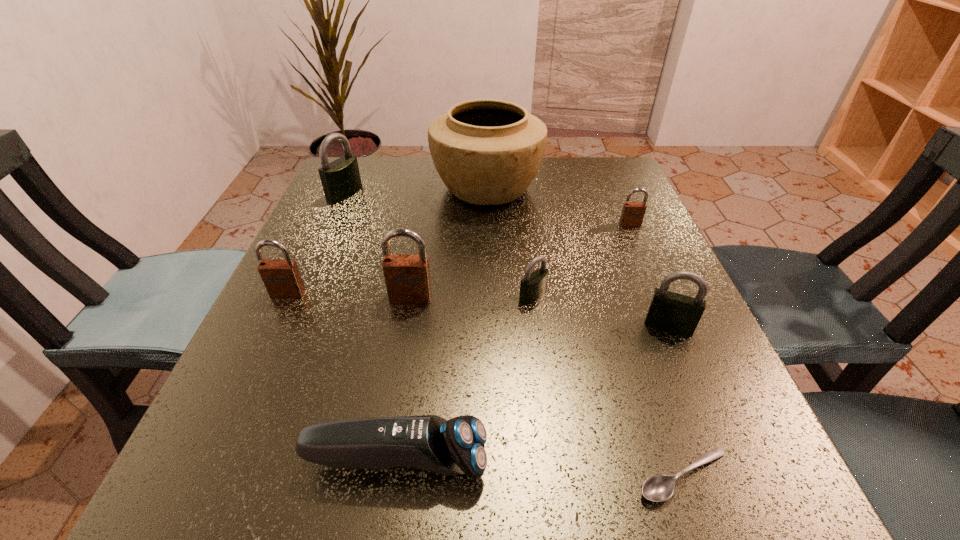
Find the location of `free space located on the back of the second farthest black padlock`. free space located on the back of the second farthest black padlock is located at coordinates (525, 235).

Identify the location of vacant space situated on the front-facing side of the smallest brown padlock. (695, 374).

Locate an element on the screen. The height and width of the screenshot is (540, 960). vacant space situated 0.300m on the head of the electric shaver is located at coordinates (720, 461).

Identify the location of vacant region located on the back of the gray soupspoon. (653, 384).

In order to click on pottery that is at the far edge in this screenshot , I will do `click(487, 152)`.

Locate an element on the screen. padlock that is positioned at the far edge is located at coordinates (340, 179).

This screenshot has height=540, width=960. Find the location of `electric shaver situated at the near edge`. electric shaver situated at the near edge is located at coordinates (456, 446).

This screenshot has height=540, width=960. I want to click on soupspoon that is at the near edge, so click(x=657, y=488).

Identify the location of electric shaver that is at the left edge. The width and height of the screenshot is (960, 540). (456, 446).

You are a GUI agent. You are given a task and a screenshot of the screen. Output one action in this format:
    pyautogui.click(x=<x>, y=<y>)
    Task: Click on the soupspoon at the right edge
    This screenshot has height=540, width=960.
    Given the screenshot: What is the action you would take?
    pyautogui.click(x=657, y=488)